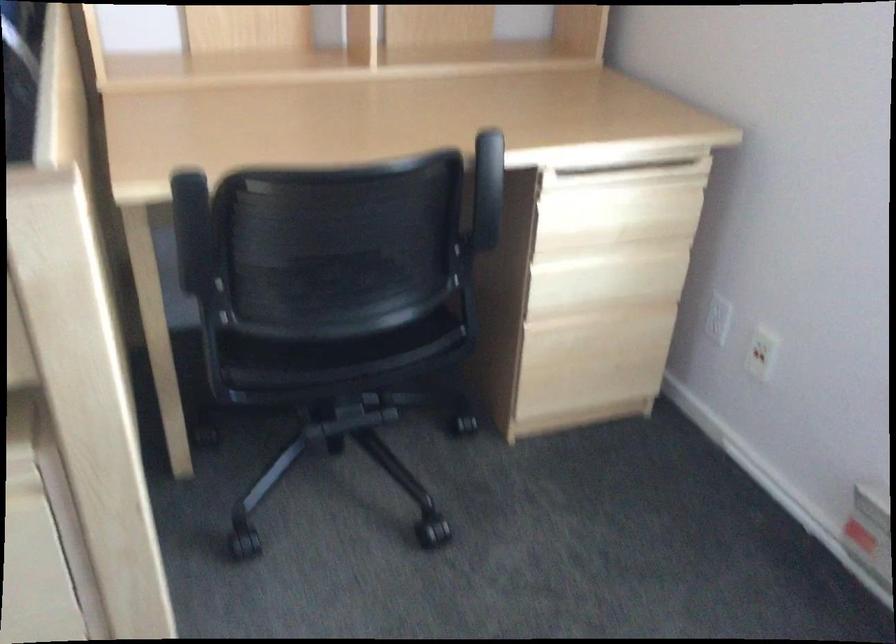
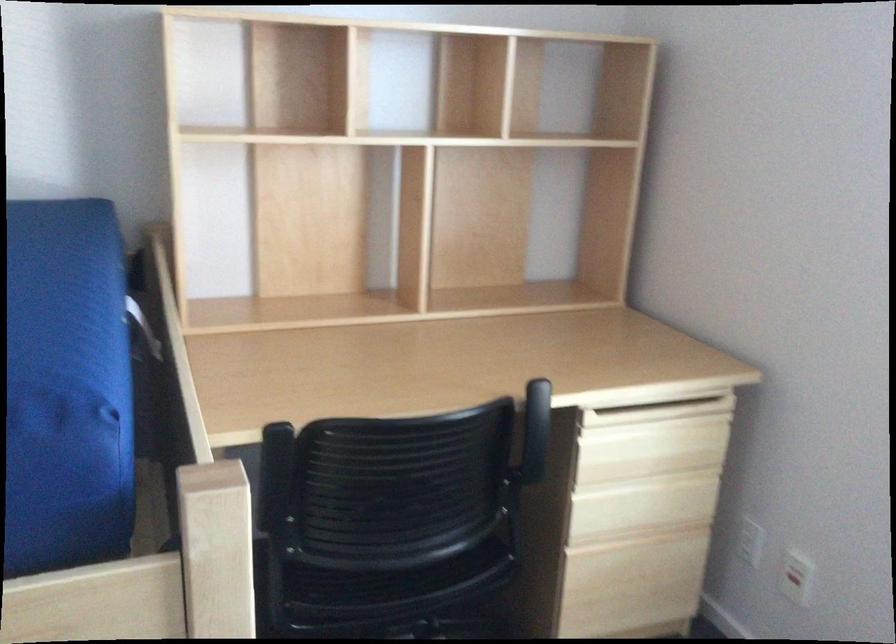
The point at (616, 216) is marked in the first image. Where is the corresponding point in the second image?

(650, 448)